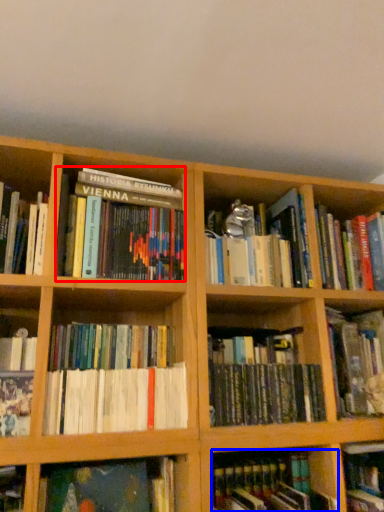
Question: Among these objects, which one is farthest to the camera, book (highlighted by a red box) or book (highlighted by a blue box)?

Choices:
 (A) book
 (B) book

Answer: (A)